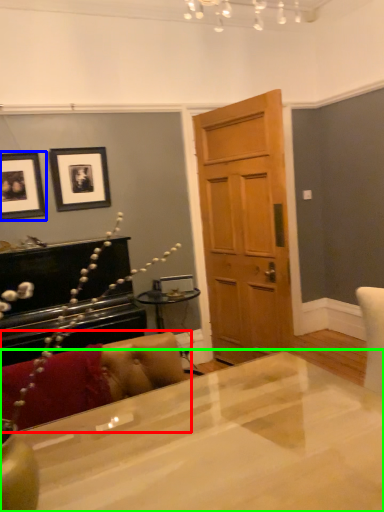
Question: Which object is positioned closest to couch (highlighted by a red box)? Select from picture frame (highlighted by a blue box) and desk (highlighted by a green box).

Choices:
 (A) picture frame
 (B) desk

Answer: (B)